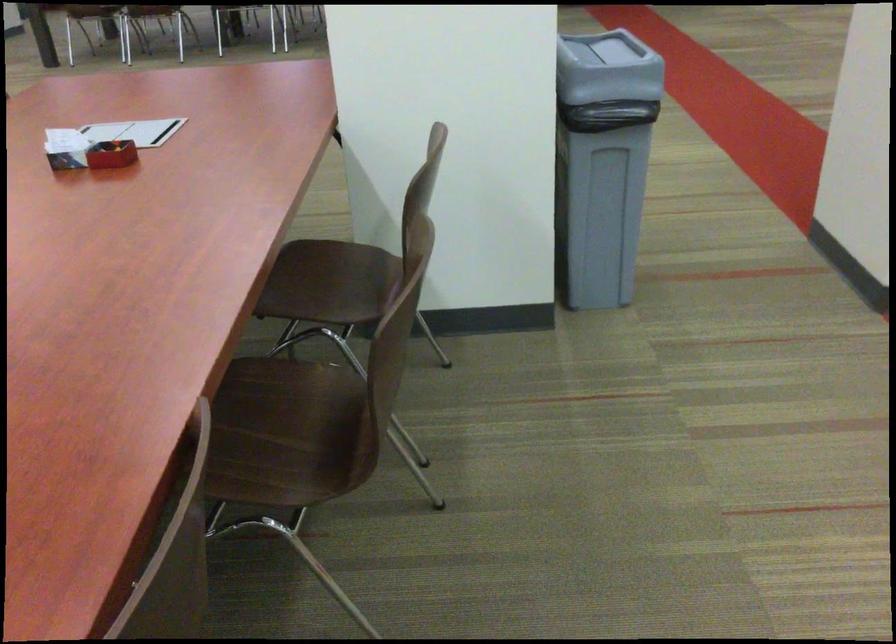
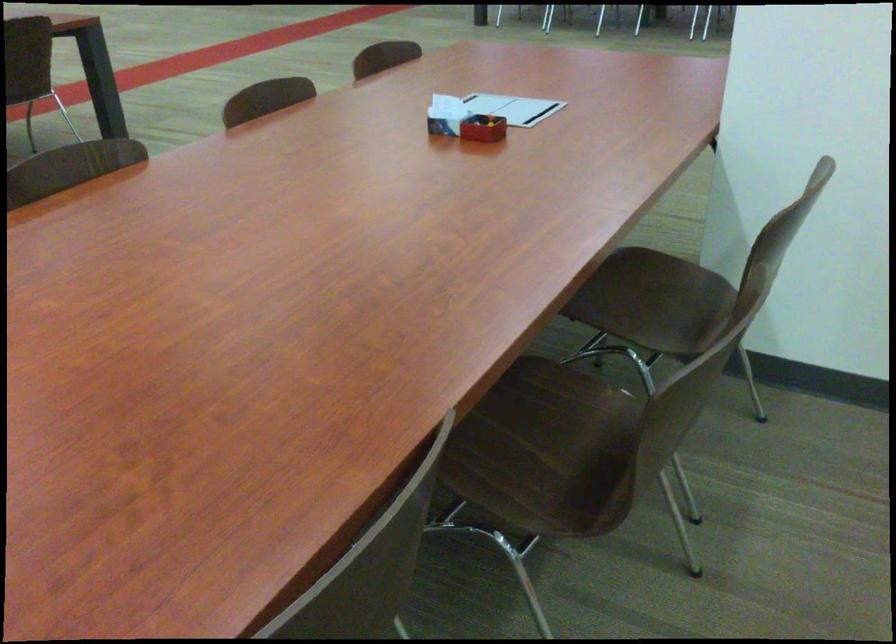
Where in the second image is the point corresponding to the point at 115,158 from the first image?

(483, 128)